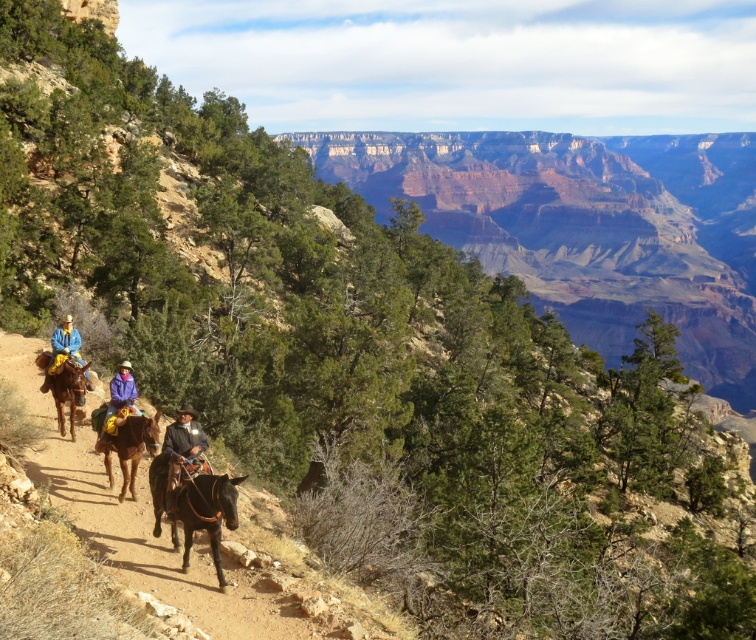
Question: Is the position of brown fuzzy horse at center more distant than that of brown leather jacket at center?

Choices:
 (A) yes
 (B) no

Answer: (A)

Question: Which of the following is the closest to the observer?

Choices:
 (A) shiny brown horse at center
 (B) brown fuzzy horse at center
 (C) matte blue shirt at center

Answer: (A)

Question: Is shiny brown horse at center behind brown leather jacket at center?

Choices:
 (A) no
 (B) yes

Answer: (A)

Question: Which object is positioned closest to the shiny brown horse at center?

Choices:
 (A) purple fleece jacket at center
 (B) matte blue shirt at center
 (C) brown leather saddle at left
 (D) brown fuzzy horse at center

Answer: (D)

Question: Does brown fuzzy horse at center appear under brown leather saddle at left?

Choices:
 (A) yes
 (B) no

Answer: (A)

Question: Which point is closer to the camera?

Choices:
 (A) (166, 474)
 (B) (180, 470)

Answer: (B)